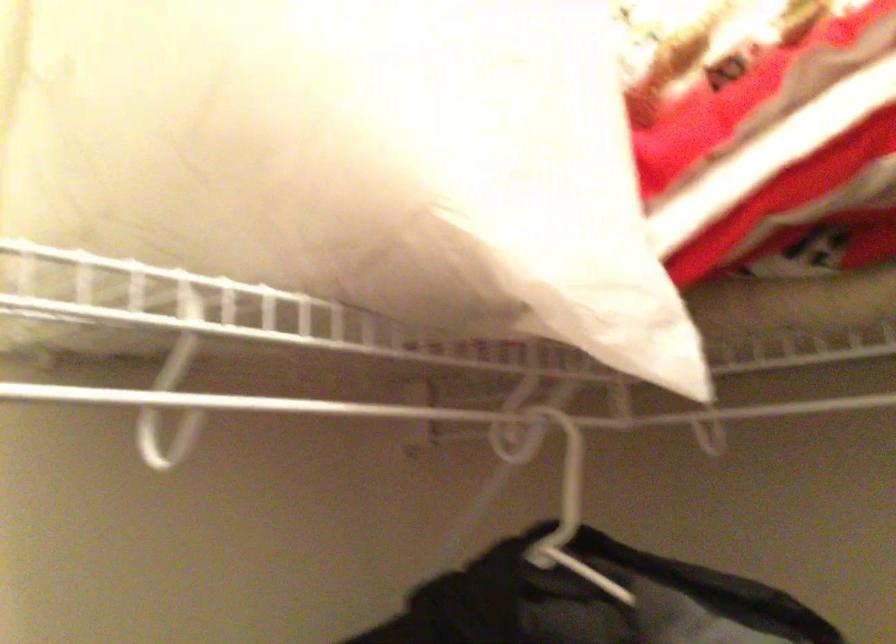
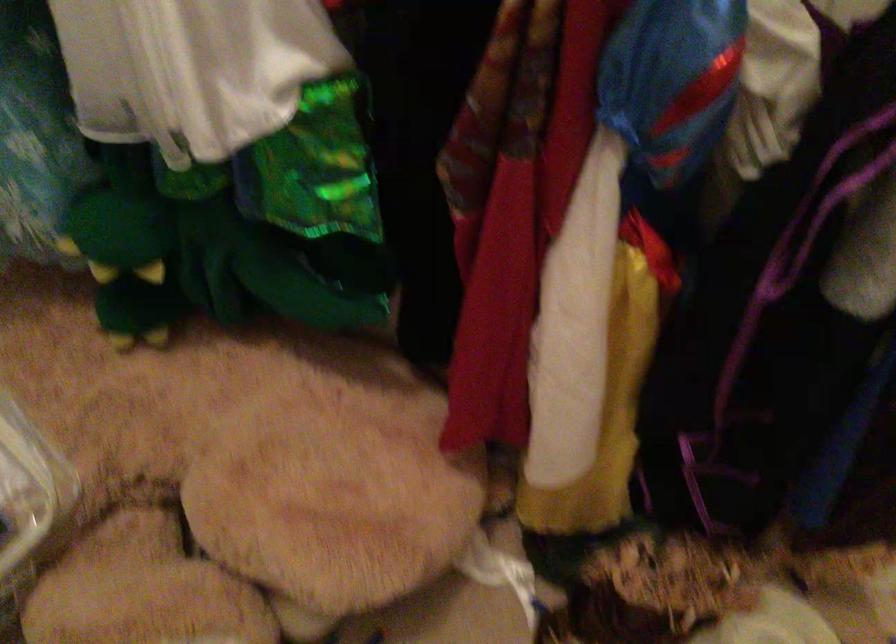
The images are taken continuously from a first-person perspective. In which direction is your viewpoint rotating?

The rotation direction of the camera is right-down.